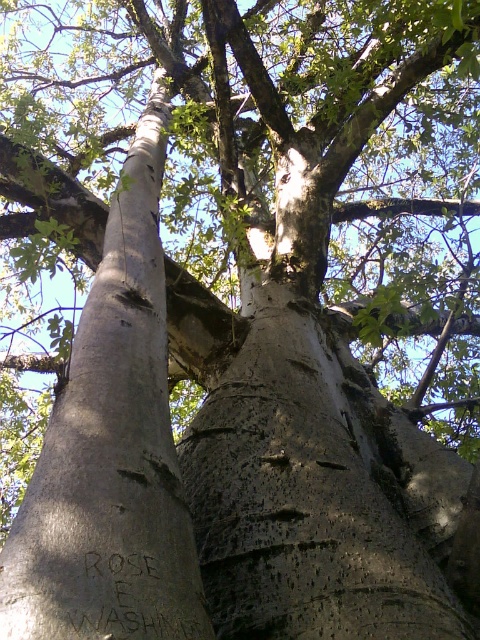
You are an artist planning to sketch the tree. You notice the smooth gray bark at center and the black carved writing at lower center. Which object should you focus on if you want to depict something wider in your drawing?

The smooth gray bark at center is wider than the black carved writing at lower center, so you should focus on the smooth gray bark at center to depict something wider in your drawing.

You are standing 1 meter away from the base of the large baobab tree. A point labeled as point [94,509] is located on the tree. Can you reach this point without moving closer to the tree?

The distance of point [94,509] from the viewer is 1.10 meters, so you are currently 1 meter away from the base. Since the point is 0.10 meters further away, you cannot reach it without moving closer to the tree.

In the scene shown: You are an archaeologist examining the tree. You notice the smooth gray bark at center and the black carved writing at lower center. Which object is taller?

The smooth gray bark at center is much taller than the black carved writing at lower center.